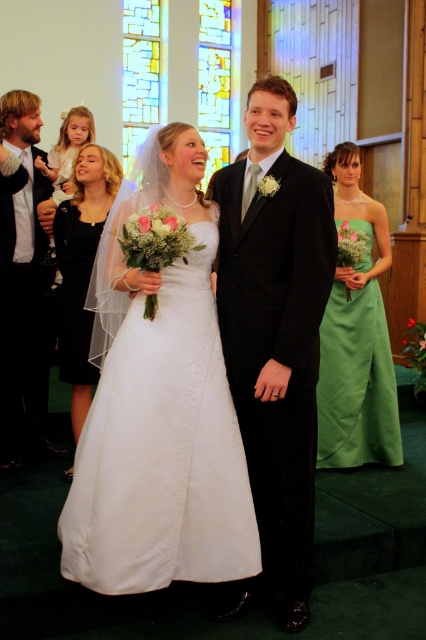
Question: Which point is farther to the camera?

Choices:
 (A) (62, 241)
 (B) (60, 326)
 (C) (25, 152)
 (D) (382, 397)

Answer: (D)

Question: Where is shiny black suit at left located in relation to black satin dress at left in the image?

Choices:
 (A) right
 (B) left

Answer: (B)

Question: Considering the relative positions of green satin dress at center and matte black dress at center in the image provided, where is green satin dress at center located with respect to matte black dress at center?

Choices:
 (A) above
 (B) below

Answer: (B)

Question: Considering the real-world distances, which object is closest to the green satin dress at center?

Choices:
 (A) shiny black suit at left
 (B) white satin dress at center
 (C) black satin suit at center
 (D) black satin dress at left

Answer: (C)

Question: Is matte black dress at center positioned in front of matte black dress at left?

Choices:
 (A) no
 (B) yes

Answer: (B)

Question: Which point is closer to the camera?

Choices:
 (A) matte black dress at left
 (B) shiny black suit at left
 (C) green satin dress at center

Answer: (B)